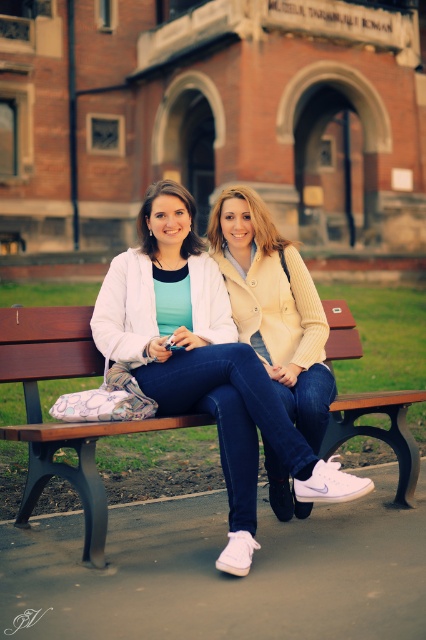
Measure the distance from wooden bench at center to matte yellow jacket at center.

Answer: 2.18 meters

This screenshot has width=426, height=640. I want to click on wooden bench at center, so click(60, 422).